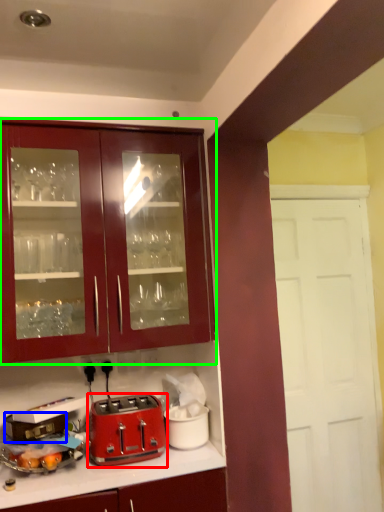
Question: Considering the real-world distances, which object is farthest from toaster (highlighted by a red box)? appliance (highlighted by a blue box) or cabinetry (highlighted by a green box)?

Choices:
 (A) appliance
 (B) cabinetry

Answer: (B)